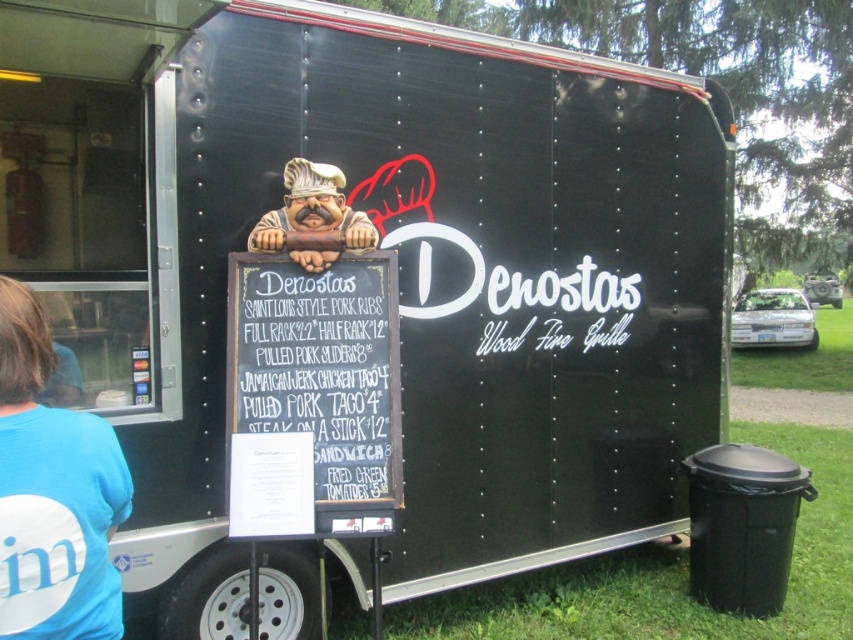
You are a customer at the food truck and want to order from the menu. The cashier points to the black chalkboard at center and the matte plastic chef at center. Which object is located to the right of the other?

The black chalkboard at center is to the right of the matte plastic chef at center.

You are a customer at the food truck and want to order a Sandwich Fried Green Tomatoes. While waiting, you notice two items in the image. Which item is narrower, the blue fabric shirt at left or the matte plastic chef at center?

The blue fabric shirt at left has a lesser width compared to the matte plastic chef at center, so the blue fabric shirt at left is narrower.